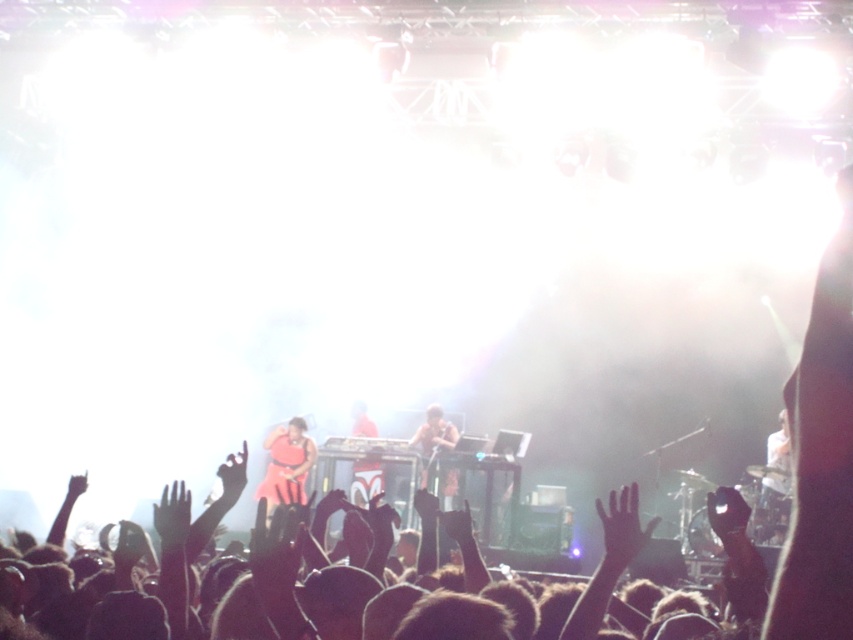
Question: Which of the following is the farthest from the observer?

Choices:
 (A) black matte hand at upper center
 (B) black matte hand at lower left
 (C) transparent plastic hand at upper left
 (D) matte pink dress at center

Answer: (D)

Question: Which of these objects is positioned closest to the black matte hand at lower left?

Choices:
 (A) black matte hand at upper center
 (B) transparent plastic hand at upper left
 (C) matte pink dress at center
 (D) shiny brown microphone at center

Answer: (C)

Question: Which of these objects is positioned closest to the transparent glass hand at center?

Choices:
 (A) transparent plastic hand at upper left
 (B) shiny brown microphone at center
 (C) black matte hand at lower left
 (D) black matte hand at upper center

Answer: (A)

Question: Does matte pink dress at center come in front of black matte hand at lower left?

Choices:
 (A) no
 (B) yes

Answer: (A)

Question: Does shiny brown microphone at center appear under black matte hand at lower left?

Choices:
 (A) no
 (B) yes

Answer: (A)

Question: Can you confirm if matte pink dress at center is wider than black matte hand at upper center?

Choices:
 (A) yes
 (B) no

Answer: (A)